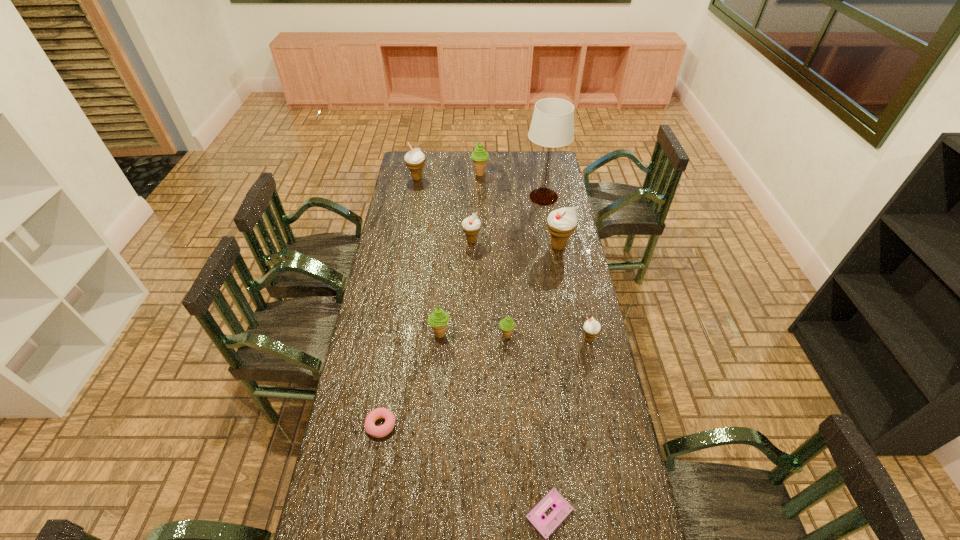
The image size is (960, 540). In order to click on object at the far left corner in this screenshot , I will do `click(415, 160)`.

Where is `vacant region at the far edge of the desktop`? The height and width of the screenshot is (540, 960). vacant region at the far edge of the desktop is located at coordinates (431, 159).

This screenshot has height=540, width=960. I want to click on free region at the left edge, so click(x=396, y=238).

You are a GUI agent. You are given a task and a screenshot of the screen. Output one action in this format:
    pyautogui.click(x=<x>, y=<y>)
    Task: Click on the vacant space at the right edge
    The width and height of the screenshot is (960, 540).
    Given the screenshot: What is the action you would take?
    pyautogui.click(x=641, y=521)

In the image, there is a desktop. Where is `vacant region at the far right corner`? vacant region at the far right corner is located at coordinates (559, 163).

The height and width of the screenshot is (540, 960). In order to click on free spot between the smallest green icecream and the second smallest white icecream in this screenshot , I will do point(489,288).

The image size is (960, 540). In order to click on vacant point located between the third smallest white icecream and the third farthest object in this screenshot , I will do `click(480, 188)`.

This screenshot has width=960, height=540. Find the location of `free space between the doughnut and the nearest white icecream`. free space between the doughnut and the nearest white icecream is located at coordinates (485, 382).

Find the location of a particular element. free space between the second shortest object and the rightmost green icecream is located at coordinates (444, 380).

What are the coordinates of `empty location between the fifth icecream from left to right and the tallest object` in the screenshot? It's located at (525, 266).